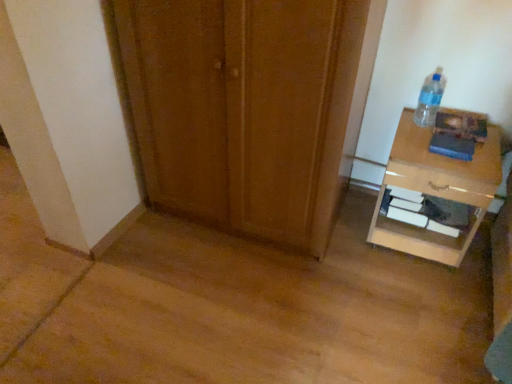
Question: Is light brown glossy nightstand at right smaller than clear plastic bottle at upper right?

Choices:
 (A) yes
 (B) no

Answer: (B)

Question: Can you confirm if light brown glossy nightstand at right is shorter than clear plastic bottle at upper right?

Choices:
 (A) yes
 (B) no

Answer: (B)

Question: Does light brown glossy nightstand at right come behind clear plastic bottle at upper right?

Choices:
 (A) yes
 (B) no

Answer: (B)

Question: Considering the relative positions of light brown glossy nightstand at right and clear plastic bottle at upper right in the image provided, is light brown glossy nightstand at right to the right of clear plastic bottle at upper right from the viewer's perspective?

Choices:
 (A) yes
 (B) no

Answer: (A)

Question: Is the position of light brown glossy nightstand at right less distant than that of clear plastic bottle at upper right?

Choices:
 (A) yes
 (B) no

Answer: (A)

Question: Would you say clear plastic bottle at upper right is to the left or to the right of light brown glossy nightstand at right in the picture?

Choices:
 (A) right
 (B) left

Answer: (B)

Question: In terms of height, does clear plastic bottle at upper right look taller or shorter compared to light brown glossy nightstand at right?

Choices:
 (A) tall
 (B) short

Answer: (B)

Question: In the image, is clear plastic bottle at upper right positioned in front of or behind light brown glossy nightstand at right?

Choices:
 (A) front
 (B) behind

Answer: (B)

Question: Is clear plastic bottle at upper right situated inside light brown glossy nightstand at right or outside?

Choices:
 (A) inside
 (B) outside

Answer: (B)

Question: From a real-world perspective, relative to wooden door at center, is clear plastic bottle at upper right vertically above or below?

Choices:
 (A) below
 (B) above

Answer: (B)

Question: Is clear plastic bottle at upper right wider or thinner than wooden door at center?

Choices:
 (A) thin
 (B) wide

Answer: (A)

Question: In terms of height, does clear plastic bottle at upper right look taller or shorter compared to wooden door at center?

Choices:
 (A) short
 (B) tall

Answer: (A)

Question: Is clear plastic bottle at upper right in front of or behind wooden door at center in the image?

Choices:
 (A) behind
 (B) front

Answer: (A)

Question: From the image's perspective, is light brown glossy nightstand at right located above or below wooden door at center?

Choices:
 (A) above
 (B) below

Answer: (B)

Question: From a real-world perspective, is light brown glossy nightstand at right positioned above or below wooden door at center?

Choices:
 (A) below
 (B) above

Answer: (A)